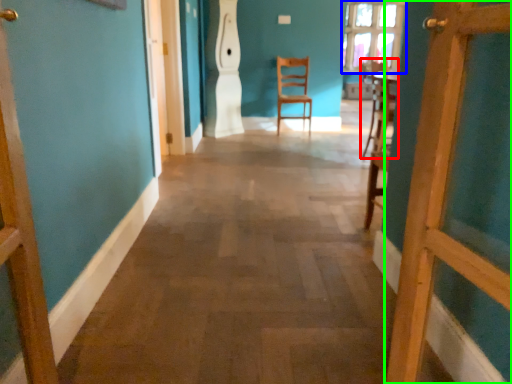
Question: Based on their relative distances, which object is nearer to chair (highlighted by a red box)? Choose from window (highlighted by a blue box) and door (highlighted by a green box).

Choices:
 (A) window
 (B) door

Answer: (B)